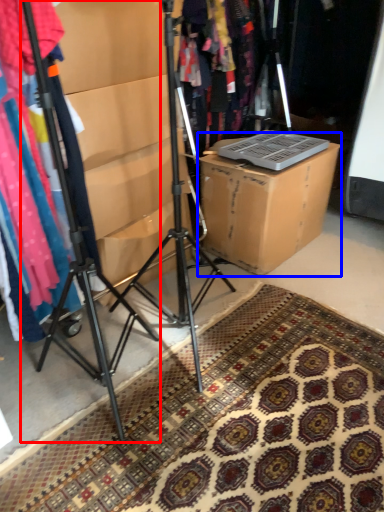
Question: Which point is closer to the camera, tripod (highlighted by a red box) or cardboard box (highlighted by a blue box)?

Choices:
 (A) tripod
 (B) cardboard box

Answer: (A)